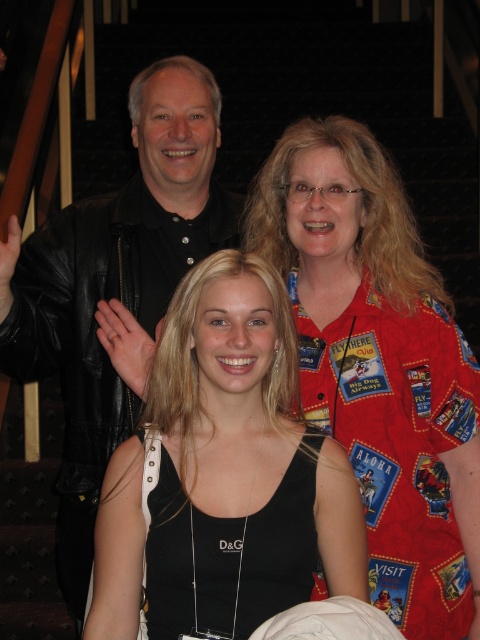
Who is taller, red patchwork shirt at upper right or black fabric dress at center?

red patchwork shirt at upper right

The height and width of the screenshot is (640, 480). Identify the location of red patchwork shirt at upper right. (380, 364).

Is point (132, 252) positioned before point (222, 544)?

No, (132, 252) is behind (222, 544).

Which is below, black leather jacket at upper left or black fabric dress at center?

black fabric dress at center is below.

Identify the location of black leather jacket at upper left. (113, 284).

Locate an element on the screen. This screenshot has width=480, height=640. black leather jacket at upper left is located at coordinates (113, 284).

How far apart are red patchwork shirt at upper right and black leather jacket at upper left?

21.62 inches

Between red patchwork shirt at upper right and black leather jacket at upper left, which one has more height?

Standing taller between the two is black leather jacket at upper left.

Is point (416, 516) positioned in front of point (10, 276)?

No, (416, 516) is behind (10, 276).

I want to click on red patchwork shirt at upper right, so [380, 364].